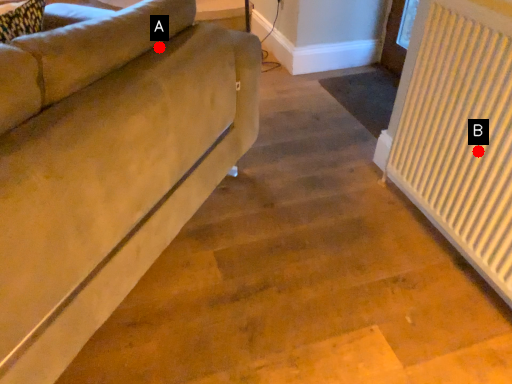
Question: Two points are circled on the image, labeled by A and B beside each circle. Which point appears closest to the camera in this image?

Choices:
 (A) A is closer
 (B) B is closer

Answer: (A)